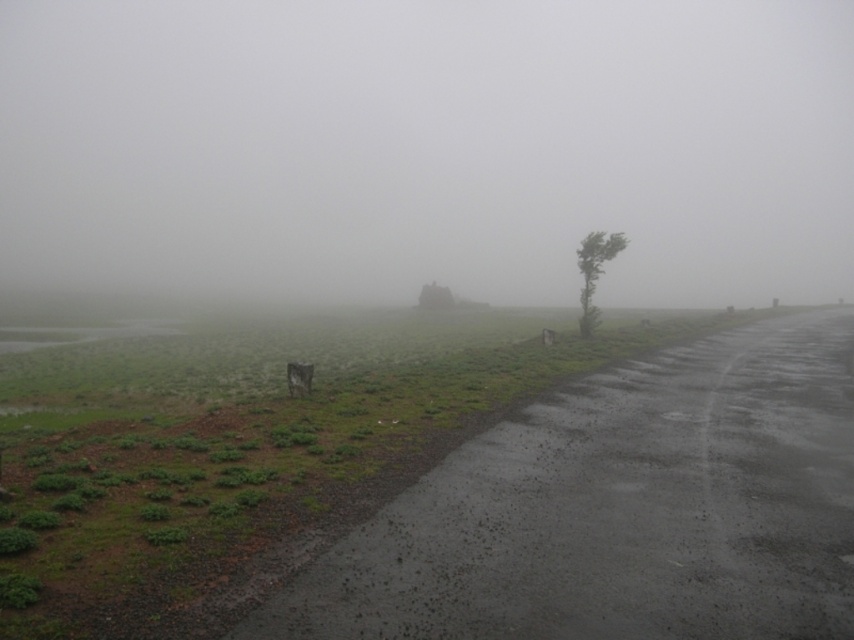
You are a hiker trying to navigate through the foggy atmosphere at center and the green leafy tree at right. Which object is closer to you?

The foggy atmosphere at center is closer to you than the green leafy tree at right, so the foggy atmosphere at center is closer.

You are a hiker trying to navigate through the foggy atmosphere at center and the green leafy tree at right. Which of these two elements occupies a bigger area in the scene?

The foggy atmosphere at center has a larger size compared to the green leafy tree at right, so it occupies a bigger area in the scene.